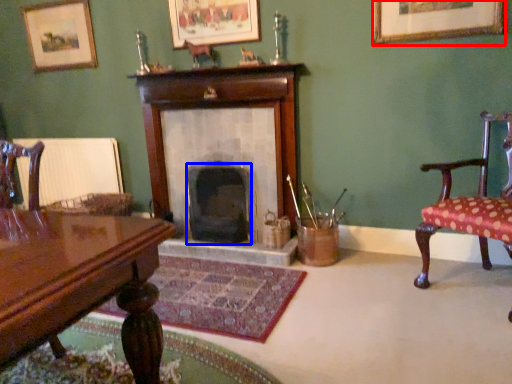
Question: Which of the following is the farthest to the observer, picture frame (highlighted by a red box) or fireplace (highlighted by a blue box)?

Choices:
 (A) picture frame
 (B) fireplace

Answer: (B)